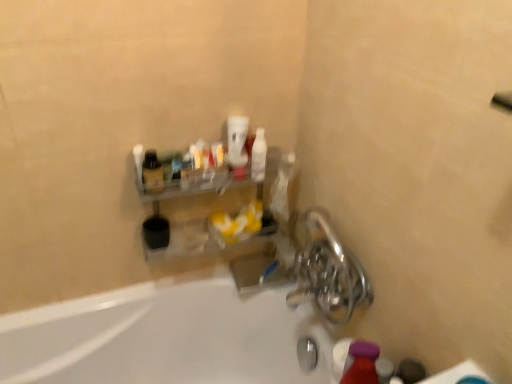
Where is `free space above clear plastic shelf at upper center (from a real-world perspective)`? The image size is (512, 384). free space above clear plastic shelf at upper center (from a real-world perspective) is located at coordinates (210, 167).